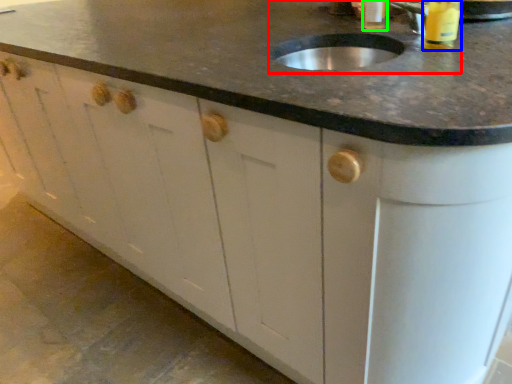
Question: Based on their relative distances, which object is farther from sink (highlighted by a red box)? Choose from beverage (highlighted by a blue box) and beverage (highlighted by a green box).

Choices:
 (A) beverage
 (B) beverage

Answer: (B)